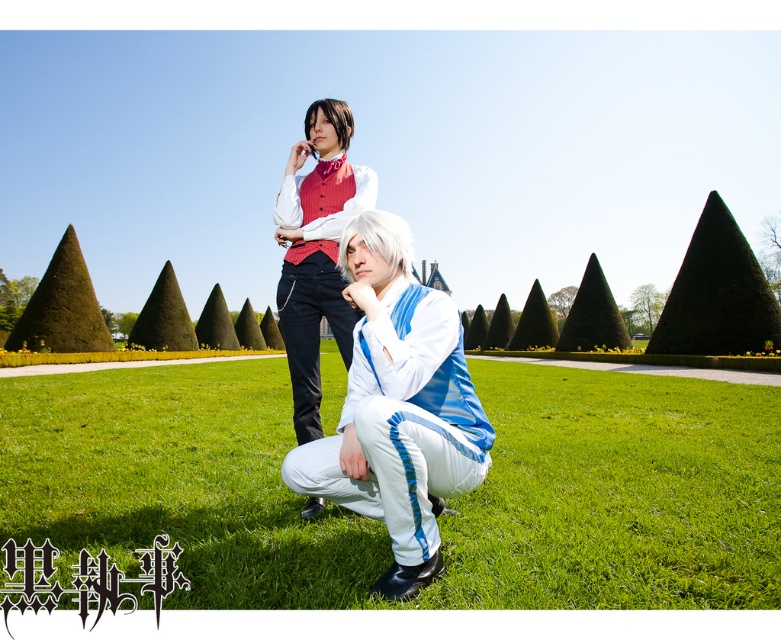
Between point (270, 465) and point (334, 216), which one is positioned behind?

The point (270, 465) is more distant.

Between green grass at lower center and matte red vest at upper center, which one appears on the right side from the viewer's perspective?

Positioned to the right is matte red vest at upper center.

Identify the location of green grass at lower center. Image resolution: width=781 pixels, height=640 pixels. (617, 493).

Does white glossy suit at center appear under matte red vest at upper center?

Correct, white glossy suit at center is located below matte red vest at upper center.

Is white glossy suit at center smaller than matte red vest at upper center?

Incorrect, white glossy suit at center is not smaller in size than matte red vest at upper center.

Does point (462, 381) come in front of point (334, 250)?

Yes, point (462, 381) is closer to viewer.

The image size is (781, 640). What are the coordinates of `white glossy suit at center` in the screenshot? It's located at (398, 406).

Which is in front, point (604, 524) or point (348, 461)?

Point (348, 461)

Is green grass at lower center bigger than white glossy suit at center?

Yes, green grass at lower center is bigger than white glossy suit at center.

Image resolution: width=781 pixels, height=640 pixels. What are the coordinates of `green grass at lower center` in the screenshot? It's located at (617, 493).